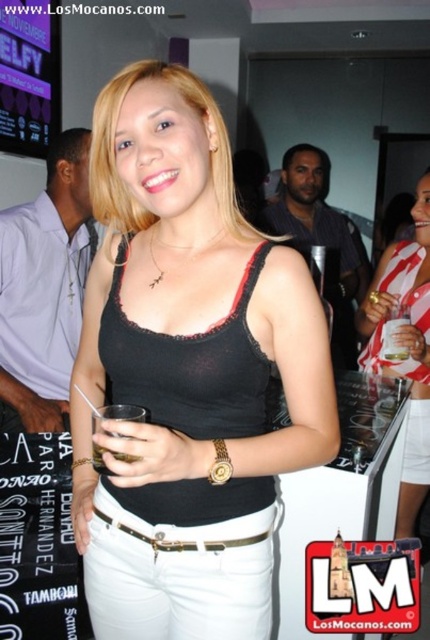
Does matte black tank top at center have a greater width compared to gold metallic belt at center?

In fact, matte black tank top at center might be narrower than gold metallic belt at center.

Which is more to the left, matte black tank top at center or gold metallic belt at center?

gold metallic belt at center

Which is in front, point (424, 486) or point (248, 538)?

Point (248, 538) is in front.

At what (x,y) coordinates should I click in order to perform the action: click on matte black tank top at center. Please return your answer as a coordinate pair (x, y). The height and width of the screenshot is (640, 430). Looking at the image, I should click on (405, 348).

Can you confirm if black matte tank top at center is smaller than gold metallic belt at center?

No.

Who is lower down, black matte tank top at center or gold metallic belt at center?

gold metallic belt at center is below.

The height and width of the screenshot is (640, 430). Find the location of `black matte tank top at center`. black matte tank top at center is located at coordinates (187, 371).

Locate an element on the screen. The width and height of the screenshot is (430, 640). black matte tank top at center is located at coordinates (187, 371).

Does black matte tank top at center have a larger size compared to matte black tank top at center?

Incorrect, black matte tank top at center is not larger than matte black tank top at center.

Does black matte tank top at center have a greater width compared to matte black tank top at center?

Correct, the width of black matte tank top at center exceeds that of matte black tank top at center.

This screenshot has width=430, height=640. What do you see at coordinates (187, 371) in the screenshot?
I see `black matte tank top at center` at bounding box center [187, 371].

Find the location of a particular element. The image size is (430, 640). black matte tank top at center is located at coordinates (187, 371).